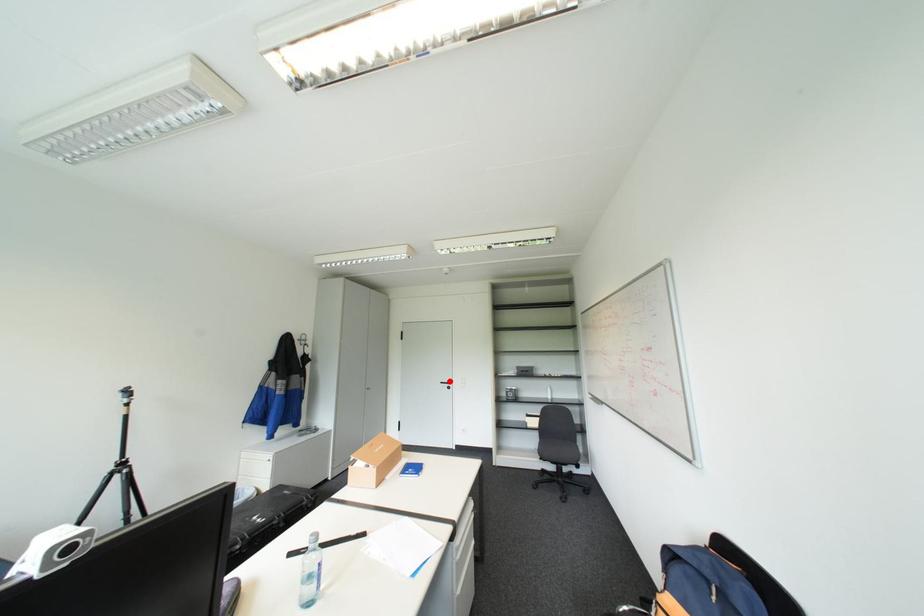
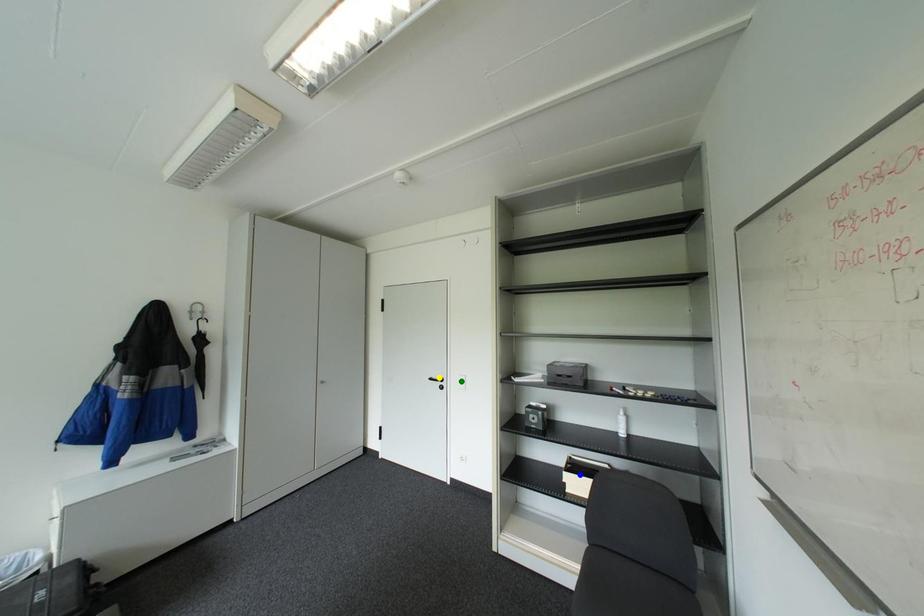
Question: I am providing you with two images of the same scene from different viewpoints. A red point is marked on the first image. You are given multiple points on the second image. Which spot in image 2 lines up with the point in image 1?

Choices:
 (A) green point
 (B) blue point
 (C) yellow point

Answer: (C)